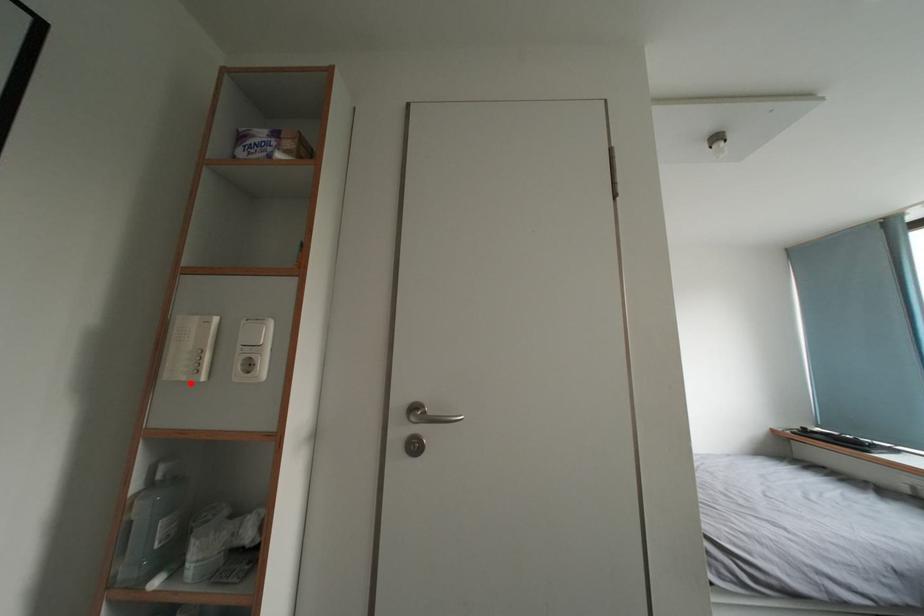
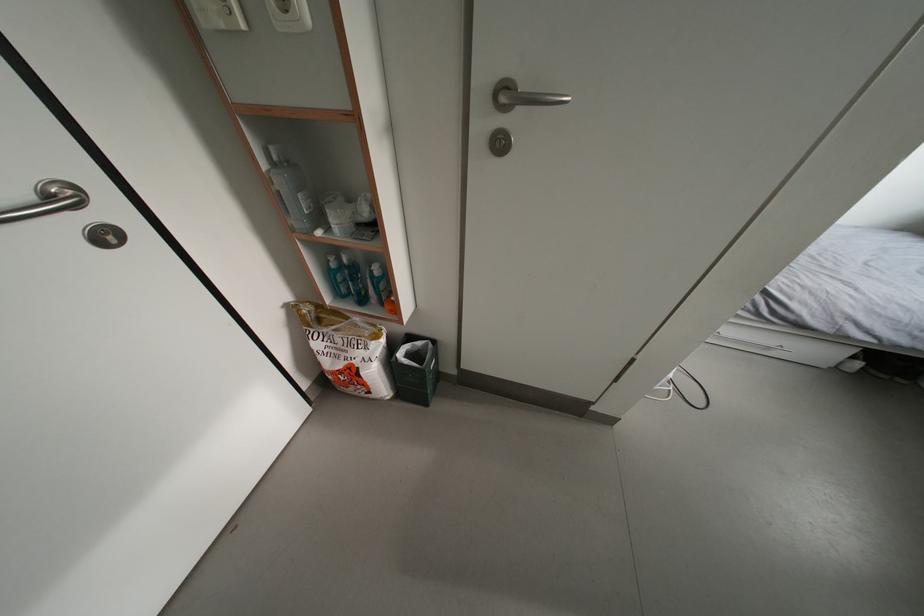
Where in the second image is the point corresponding to the highlighted location from the first image?

(229, 30)